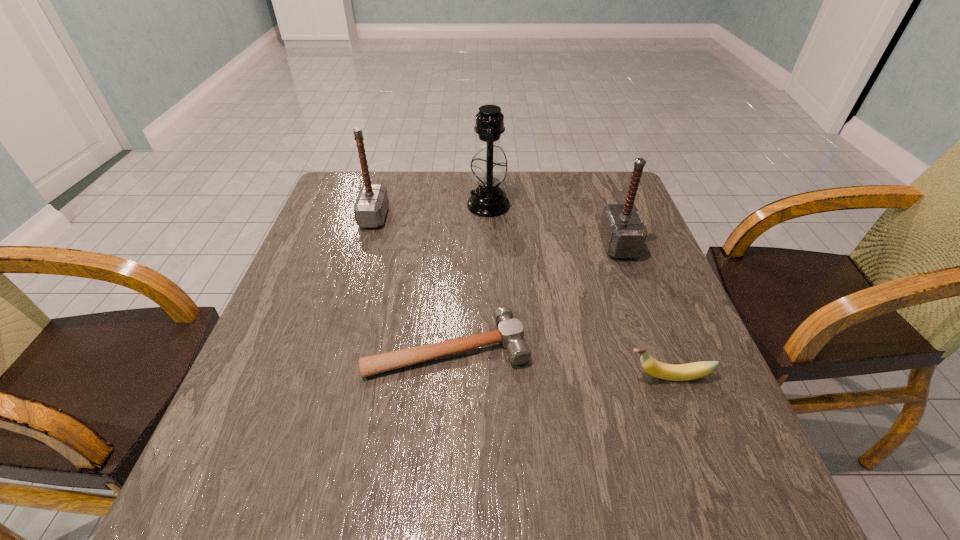
Identify the location of vacant space that satisfies the following two spatial constraints: 1. on the back side of the oil lamp; 2. on the right side of the shortest hammer. (457, 205).

Locate an element on the screen. The width and height of the screenshot is (960, 540). vacant position in the image that satisfies the following two spatial constraints: 1. on the back side of the second hammer from left to right; 2. on the striking surface of the leftmost hammer is located at coordinates (456, 217).

At what (x,y) coordinates should I click in order to perform the action: click on vacant point that satisfies the following two spatial constraints: 1. on the back side of the shortest hammer; 2. on the right side of the rightmost hammer. Please return your answer as a coordinate pair (x, y). Image resolution: width=960 pixels, height=540 pixels. Looking at the image, I should click on (454, 245).